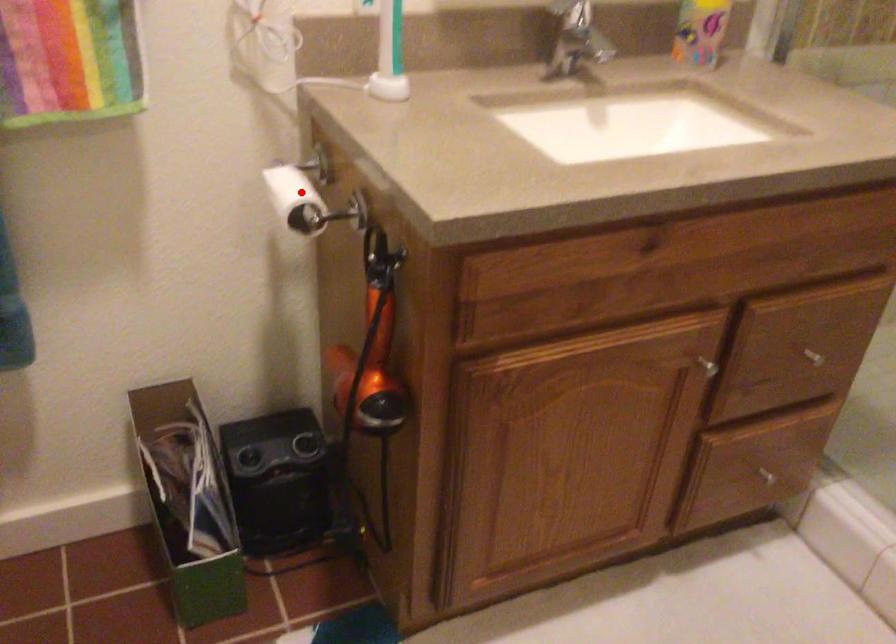
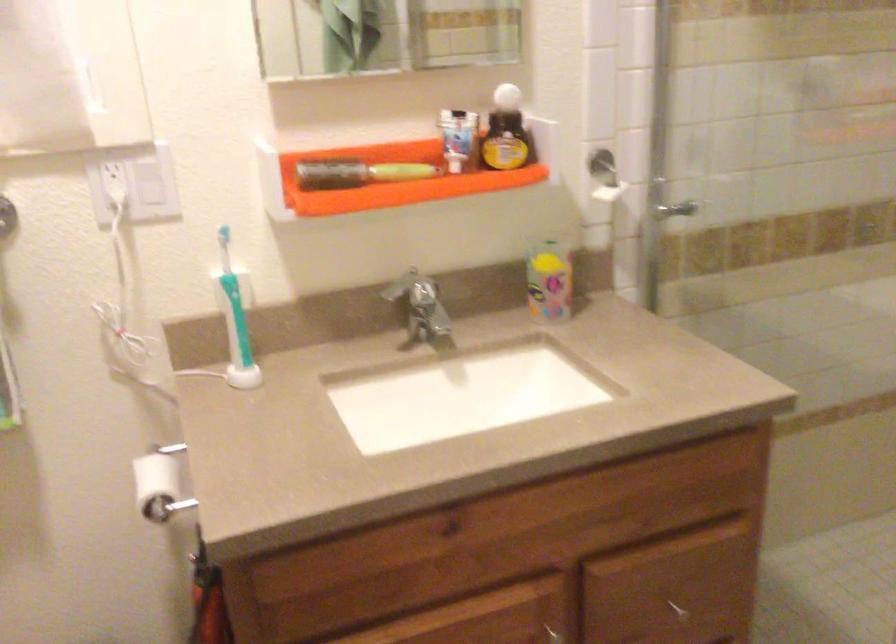
Question: I am providing you with two images of the same scene from different viewpoints. A red point is shown in image1. For the corresponding object point in image2, is it positioned nearer or farther from the camera?

Choices:
 (A) Nearer
 (B) Farther

Answer: (B)